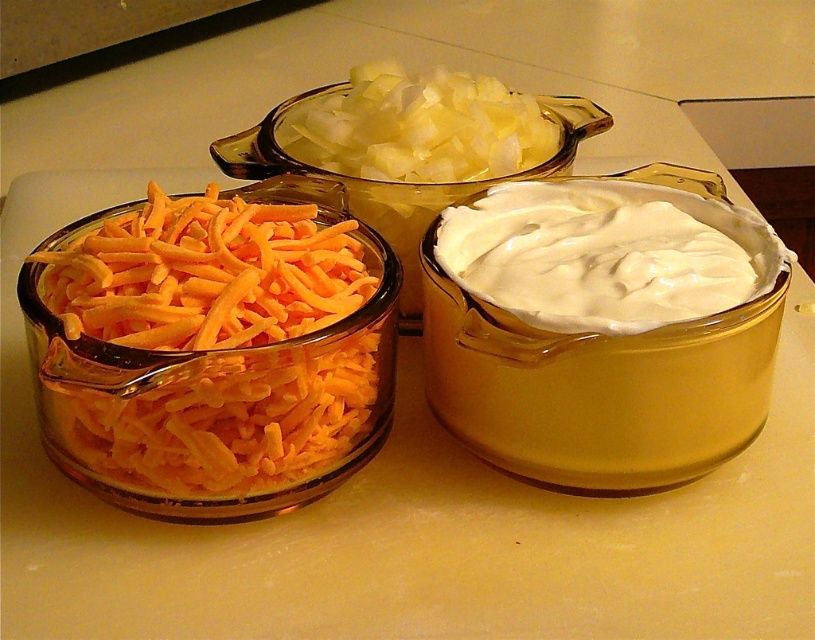
You are a chef preparing a dish and need to locate the orange shredded cheese at lower left. According to the image coordinates, where exactly is it located?

The orange shredded cheese at lower left is located at point coordinates of (x=212, y=340).

You are a chef preparing a dish and need to arrange the ingredients in a specific order. You have the orange shredded cheese at lower left and the white creamy spread at center. Based on their positions, which ingredient is closer to the edge of the countertop?

The orange shredded cheese at lower left is located below the white creamy spread at center, so it is closer to the edge of the countertop.

You are standing in front of the three glass bowls on the countertop. You need to place a new ingredient between the two points marked as point (x=166, y=259) and point (x=593, y=243). Which point should the new ingredient be closer to if it needs to be placed in front of the other point?

The new ingredient should be placed closer to point (x=166, y=259) because it is in front of point (x=593, y=243).